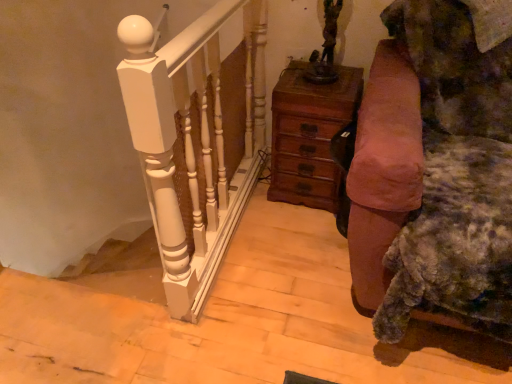
I want to click on vacant space that is in between velvet brown couch at right and wooden chest of drawers at center, so click(x=308, y=251).